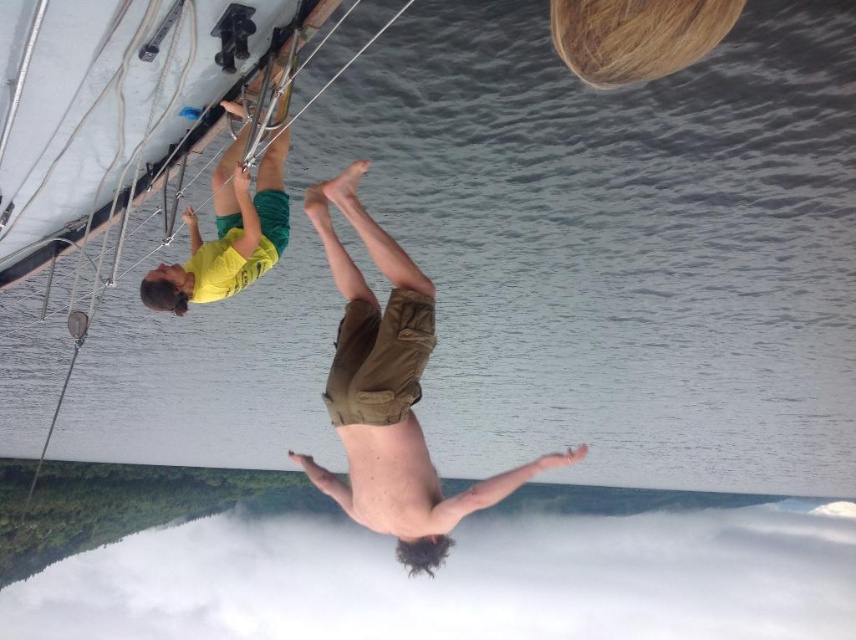
Is point (415, 321) positioned behind point (236, 262)?

No, it is not.

Which is more to the right, brown cotton shorts at lower center or yellow fabric shorts at upper left?

Positioned to the right is brown cotton shorts at lower center.

What are the coordinates of `brown cotton shorts at lower center` in the screenshot? It's located at (390, 394).